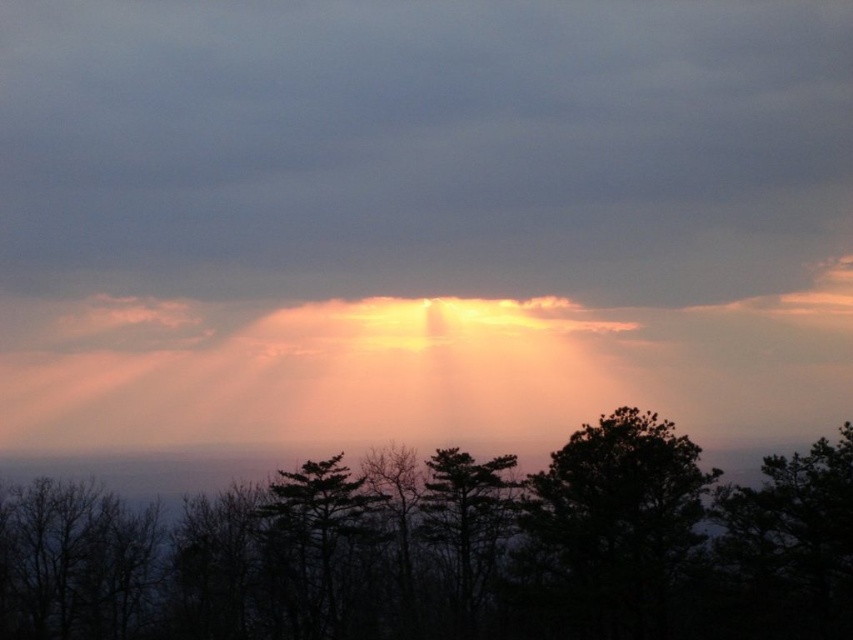
You are standing in the sunset scene and want to take a photo of the dark green textured tree at center. If your camera can focus on objects up to 250 feet away, will you need to adjust your position to capture a clear image?

The dark green textured tree at center is 246.22 feet away from the viewer. Since this distance is within the camera focus range of up to 250 feet, you don not need to adjust your position to capture a clear image.

You are an astronomer observing the sunset scene. You notice two points in the sky, one at point (x=468, y=611) and another at point (x=306, y=472). Which point is closer to you?

Point (x=468, y=611) is in front of point (x=306, y=472), so the point at (x=468, y=611) is closer to you.

You are an artist trying to paint the sunset scene. You want to place the silhouette tree at center in your painting. According to the coordinates given, where should you position it on your canvas?

The silhouette tree at center should be positioned at coordinates point (450,548) on the canvas.